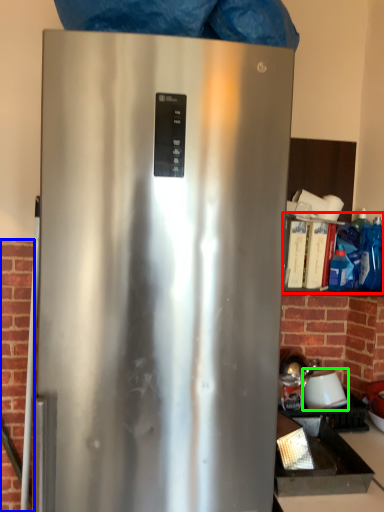
Question: Which is nearer to the shelf (highlighted by a red box)? brickwork (highlighted by a blue box) or appliance (highlighted by a green box).

Choices:
 (A) brickwork
 (B) appliance

Answer: (B)